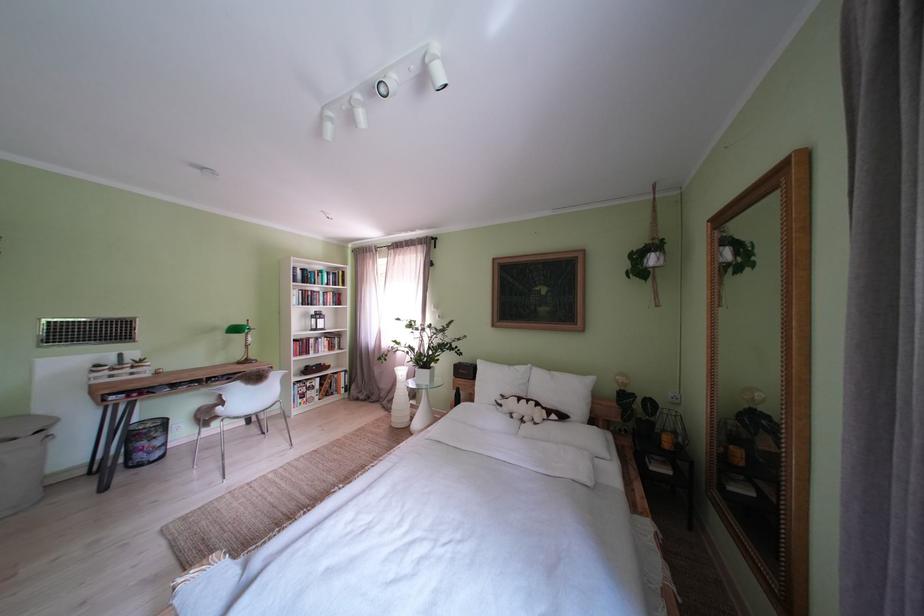
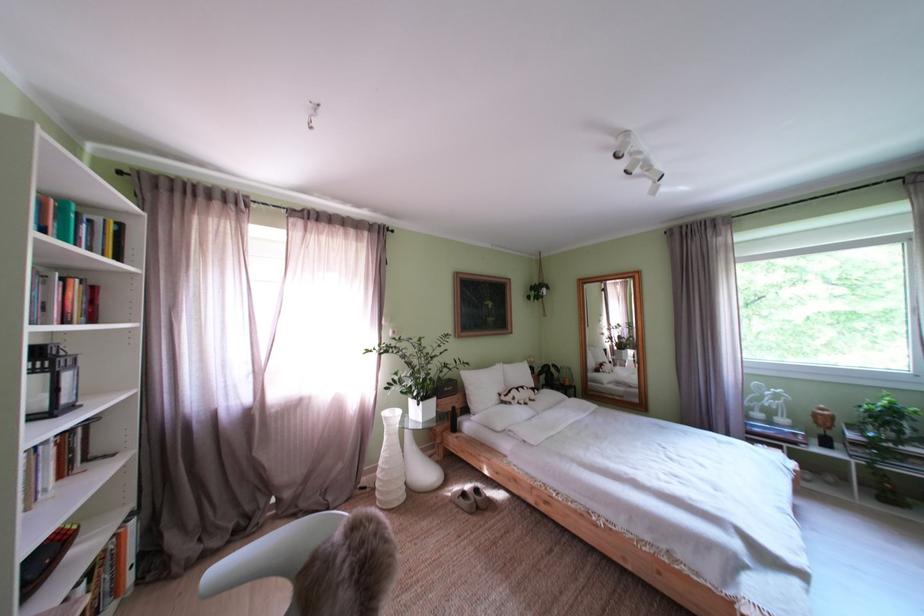
In the second image, find the point that corresponds to [512,411] in the first image.

(525, 405)